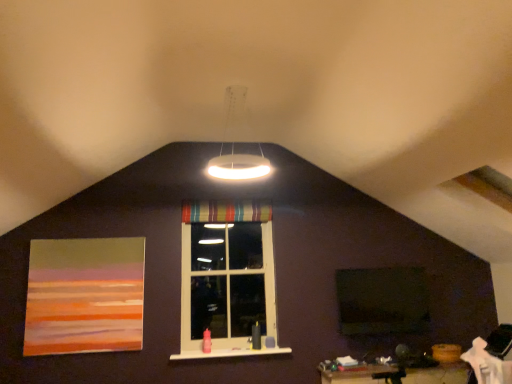
Identify the location of free space above matte acrylic painting at left (from a real-world perspective). (91, 235).